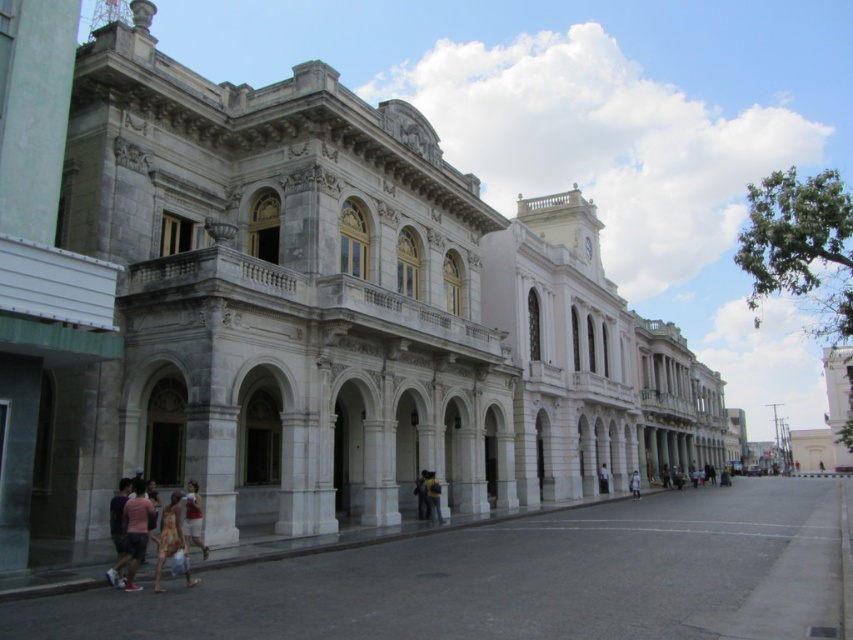
Based on the photo, you are an artist preparing to paint a portrait of the grand building. You have two cloths to clean your brushes, a yellow fabric at center and a white cotton shirt at center. Which cloth has more material thickness to better absorb brush cleaning solution?

The white cotton shirt at center is thicker than the yellow fabric at center, so it can better absorb the brush cleaning solution.

You are standing in front of the grand neoclassical building and want to take a photo. There are two points marked on your camera screen at coordinates point (381, 600) and point (426, 492). Which point is closer to you when you take the photo?

Point (381, 600) is closer to the camera than point (426, 492).